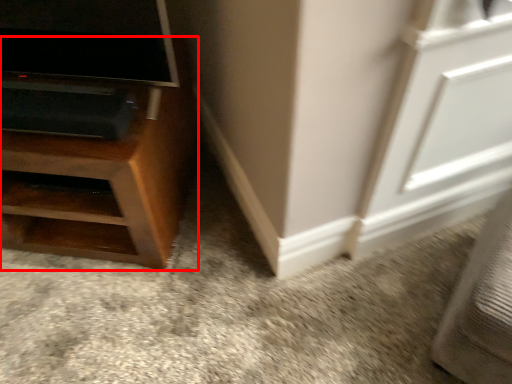
Question: From the image's perspective, where is furniture (annotated by the red box) located relative to screen door?

Choices:
 (A) below
 (B) above

Answer: (B)